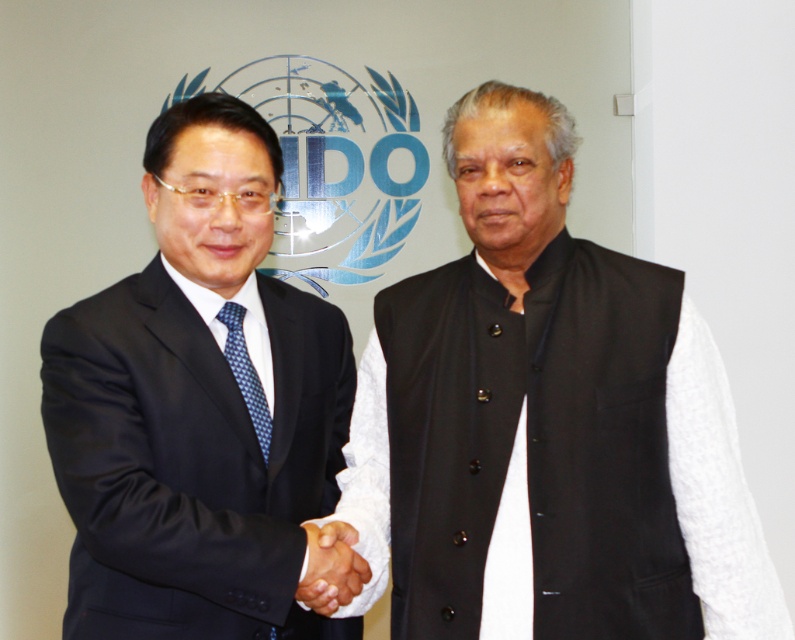
Who is higher up, black cotton vest at center or black matte hand at center?

Positioned higher is black cotton vest at center.

Does black cotton vest at center have a lesser height compared to black matte hand at center?

Incorrect, black cotton vest at center's height does not fall short of black matte hand at center's.

Which is in front, point (633, 276) or point (339, 525)?

Point (339, 525) is more forward.

Locate an element on the screen. black cotton vest at center is located at coordinates (547, 422).

Is black cotton vest at center wider than blue dotted tie at left?

Yes, black cotton vest at center is wider than blue dotted tie at left.

Can you confirm if black cotton vest at center is bigger than blue dotted tie at left?

Yes.

Identify the location of black cotton vest at center. The width and height of the screenshot is (795, 640). (547, 422).

How far apart are matte black suit at left and black matte hand at center?

The distance of matte black suit at left from black matte hand at center is 11.04 inches.

Is point (351, 621) positioned behind point (318, 529)?

Yes, it is behind point (318, 529).

Does point (243, 403) come closer to viewer compared to point (313, 579)?

No, (243, 403) is further to viewer.

Where is `matte black suit at left`? This screenshot has height=640, width=795. matte black suit at left is located at coordinates (198, 404).